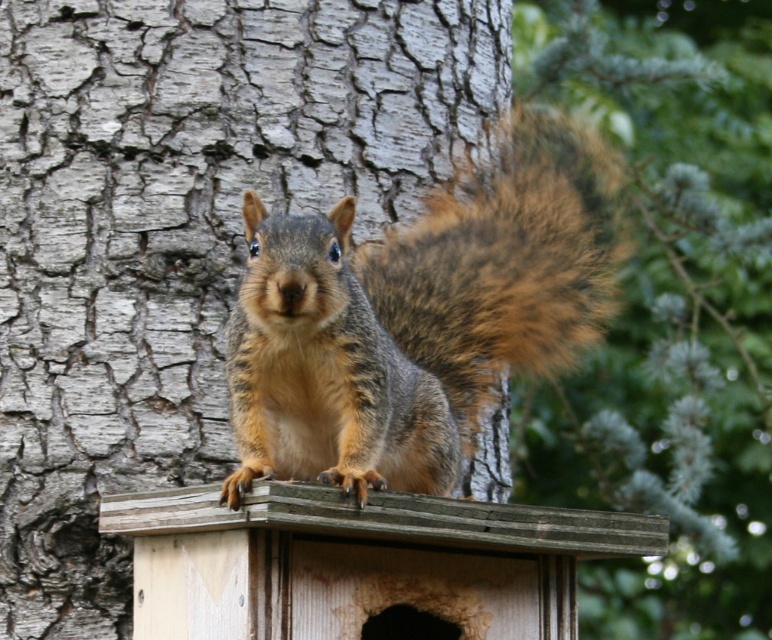
You are a bird flying towards the gray rough bark tree trunk at center and the wooden bird feeder at center. Which object will you reach first?

You will reach the gray rough bark tree trunk at center first because it is closer to you than the wooden bird feeder at center.

You are a photographer aiming to capture the squirrel on the birdhouse. You notice two points marked on your camera screen at coordinates point (x=137, y=275) and point (x=245, y=604). Which point is closer to your camera lens?

Point (x=137, y=275) is further to the camera than point (x=245, y=604), so the point closer to the camera lens is point (x=245, y=604).